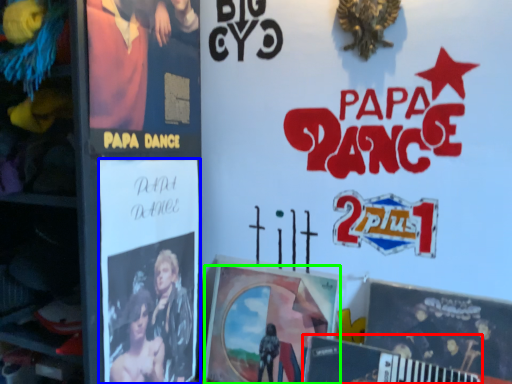
Question: Which is farther away from magazine (highlighted by a red box)? poster (highlighted by a blue box) or poster (highlighted by a green box)?

Choices:
 (A) poster
 (B) poster

Answer: (A)